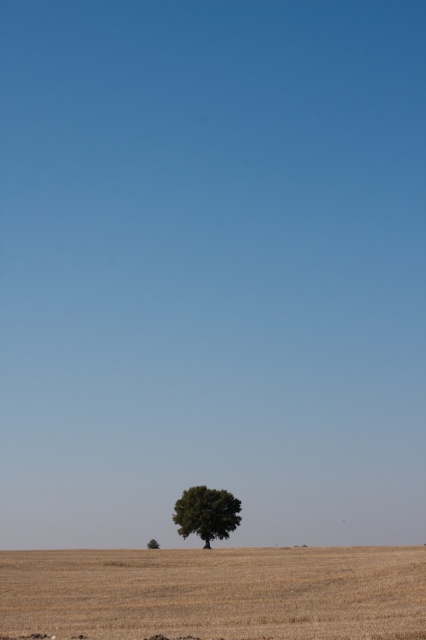
Question: From the image, what is the correct spatial relationship of brown dry grass at lower center in relation to green leafy tree at center?

Choices:
 (A) right
 (B) left

Answer: (A)

Question: Among these objects, which one is farthest from the camera?

Choices:
 (A) green leafy tree at lower center
 (B) green leafy tree at center

Answer: (A)

Question: Can you confirm if brown dry grass at lower center is thinner than green leafy tree at lower center?

Choices:
 (A) yes
 (B) no

Answer: (B)

Question: Is green leafy tree at center wider than green leafy tree at lower center?

Choices:
 (A) yes
 (B) no

Answer: (B)

Question: Considering the real-world distances, which object is closest to the green leafy tree at center?

Choices:
 (A) brown dry grass at lower center
 (B) green leafy tree at lower center

Answer: (A)

Question: Which object appears farthest from the camera in this image?

Choices:
 (A) green leafy tree at lower center
 (B) green leafy tree at center

Answer: (A)